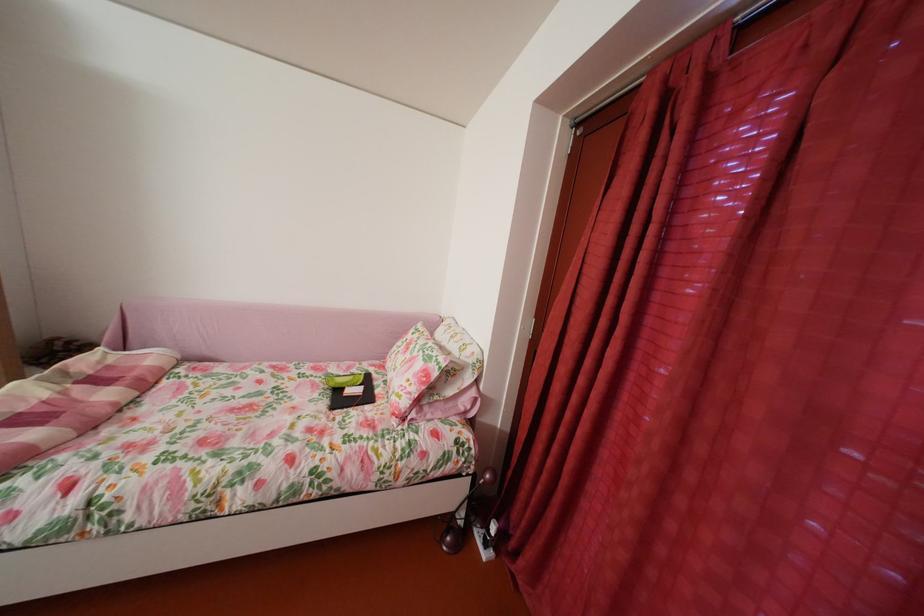
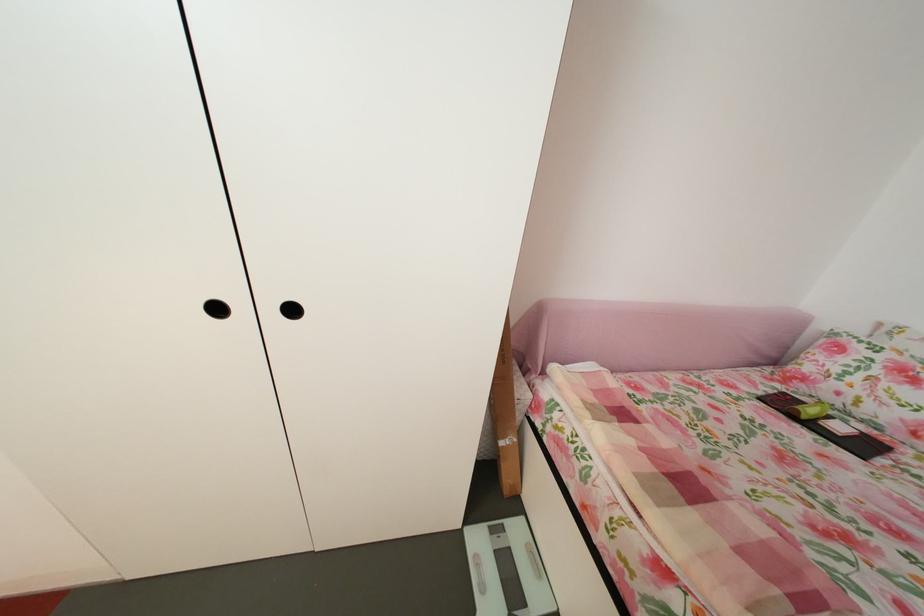
Question: In a continuous first-person perspective shot, in which direction is the camera moving?

Choices:
 (A) Left
 (B) Right
 (C) Forward
 (D) Backward

Answer: (A)